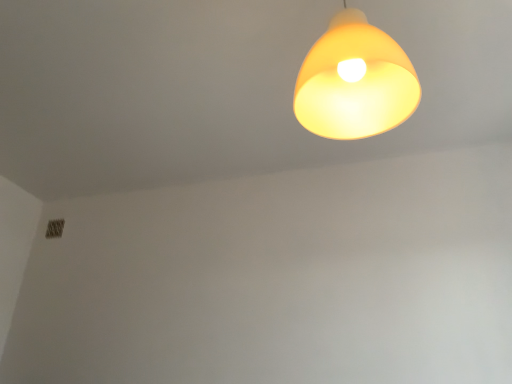
Question: Should I look upward or downward to see matte yellow plastic lampshade at upper center?

Choices:
 (A) down
 (B) up

Answer: (B)